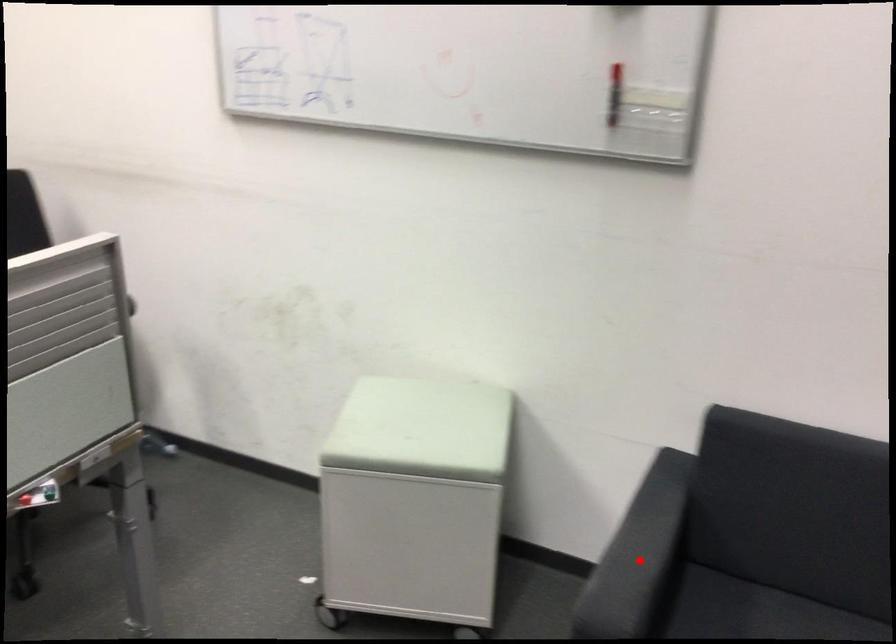
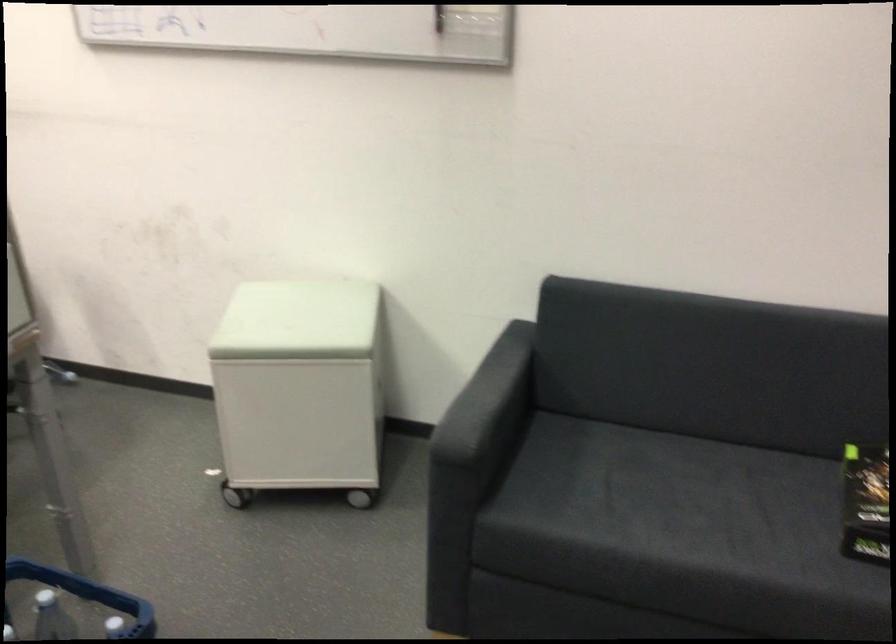
Question: I am providing you with two images of the same scene from different viewpoints. In image1, a red point is highlighted. Considering the same 3D point in image2, which of the following is correct?

Choices:
 (A) It is closer
 (B) It is farther

Answer: (B)